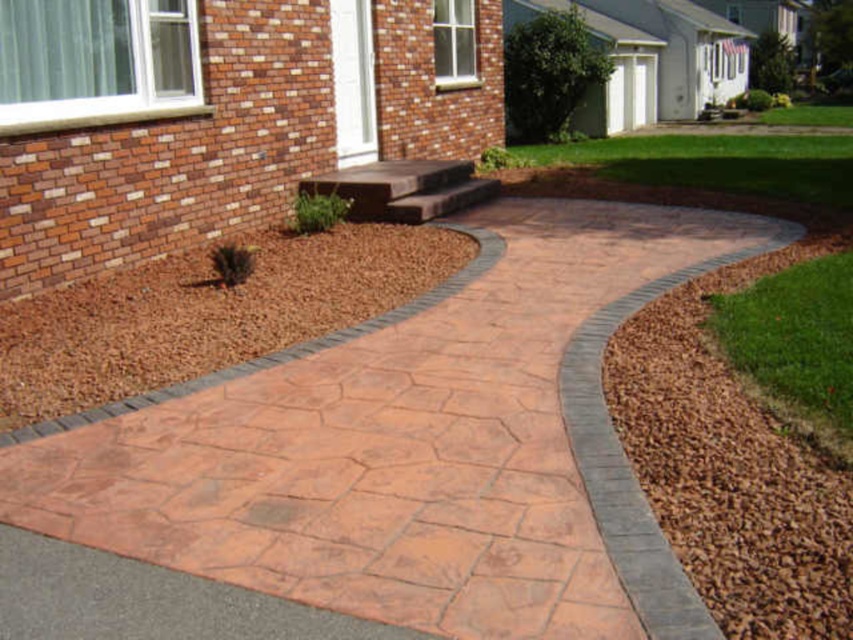
Question: Which object is positioned closest to the green grass at lower right?

Choices:
 (A) terracotta concrete path at center
 (B) brown mulch at lower left
 (C) brown gravel at lower right

Answer: (C)

Question: Which object is farther from the camera taking this photo?

Choices:
 (A) brown gravel at lower right
 (B) terracotta concrete path at center

Answer: (B)

Question: Which of these objects is positioned farthest from the brown mulch at lower left?

Choices:
 (A) terracotta concrete path at center
 (B) green grass at lower right

Answer: (B)

Question: Does terracotta concrete path at center have a smaller size compared to green grass at lower right?

Choices:
 (A) no
 (B) yes

Answer: (B)

Question: Is brown gravel at lower right wider than green grass at lower right?

Choices:
 (A) no
 (B) yes

Answer: (A)

Question: Is terracotta concrete path at center positioned behind green grass at lower right?

Choices:
 (A) no
 (B) yes

Answer: (A)